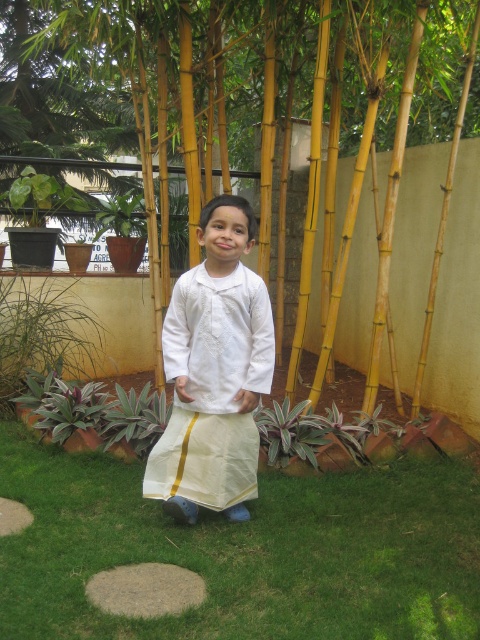
Can you confirm if green grass at center is bigger than yellow bamboo forest at center?

Incorrect, green grass at center is not larger than yellow bamboo forest at center.

Is point (421, 582) closer to viewer compared to point (309, 170)?

Yes, point (421, 582) is closer to viewer.

Find the location of `green grass at center`. green grass at center is located at coordinates (247, 550).

Which of these two, yellow bamboo forest at center or white cotton kurta at center, stands taller?

white cotton kurta at center

How distant is yellow bamboo forest at center from white cotton kurta at center?

The distance of yellow bamboo forest at center from white cotton kurta at center is 2.25 meters.

Does point (288, 60) lie behind point (222, 451)?

Yes, point (288, 60) is behind point (222, 451).

Image resolution: width=480 pixels, height=640 pixels. What are the coordinates of `yellow bamboo forest at center` in the screenshot? It's located at (212, 88).

Which is in front, point (155, 545) or point (173, 330)?

Point (155, 545) is more forward.

Does green grass at center have a smaller size compared to white cotton kurta at center?

No.

The height and width of the screenshot is (640, 480). I want to click on green grass at center, so click(x=247, y=550).